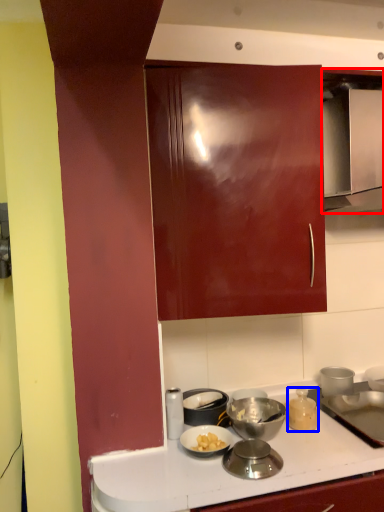
Question: Which object is further to the camera taking this photo, home appliance (highlighted by a red box) or kitchen appliance (highlighted by a blue box)?

Choices:
 (A) home appliance
 (B) kitchen appliance

Answer: (B)